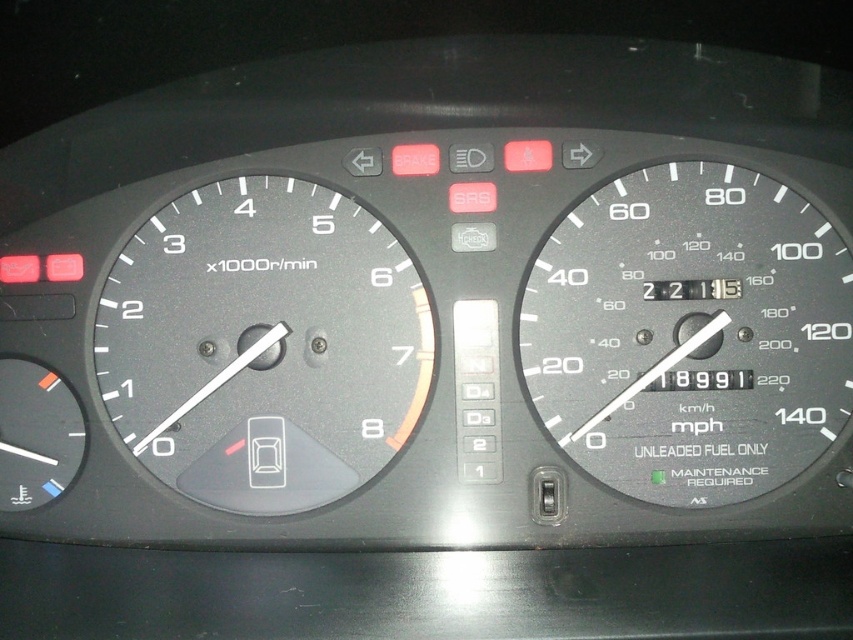
Who is positioned more to the right, black matte speedometer at center right or matte black tachometer at left?

Positioned to the right is black matte speedometer at center right.

Does black matte speedometer at center right have a lesser height compared to matte black tachometer at left?

Yes, black matte speedometer at center right is shorter than matte black tachometer at left.

Who is more distant from viewer, (688, 237) or (144, 410)?

The point (144, 410) is behind.

At what (x,y) coordinates should I click in order to perform the action: click on black matte speedometer at center right. Please return your answer as a coordinate pair (x, y). The image size is (853, 640). Looking at the image, I should click on (689, 333).